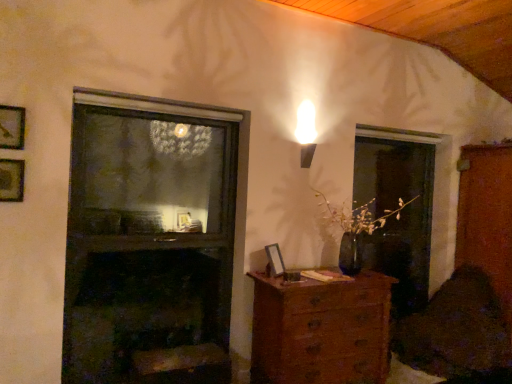
Find the location of a particular element. free point above dark glass fireplace at center (from a real-world perspective) is located at coordinates (135, 112).